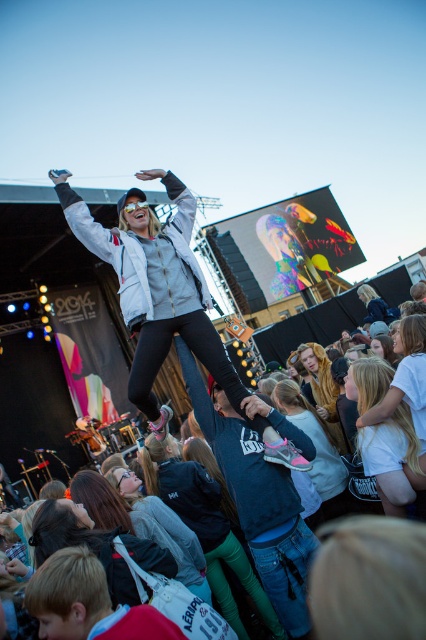
Question: Is matte black jacket at lower center positioned before fluffy brown bear at center?

Choices:
 (A) no
 (B) yes

Answer: (B)

Question: Does dark gray hoodie at center appear under fluffy brown bear at center?

Choices:
 (A) yes
 (B) no

Answer: (A)

Question: Based on their relative distances, which object is farther from the white matte shirt at center?

Choices:
 (A) white matte jacket at center
 (B) dark blue jeans at center
 (C) dark gray hoodie at center

Answer: (B)

Question: Observing the image, what is the correct spatial positioning of matte black jacket at lower center in reference to dark gray hoodie at center?

Choices:
 (A) below
 (B) above

Answer: (A)

Question: Among these points, which one is farthest from the camera?

Choices:
 (A) (236, 424)
 (B) (331, 516)
 (C) (319, 353)

Answer: (C)

Question: Which of these objects is positioned closest to the white matte jacket at center?

Choices:
 (A) white matte shirt at center
 (B) fluffy brown bear at center

Answer: (A)